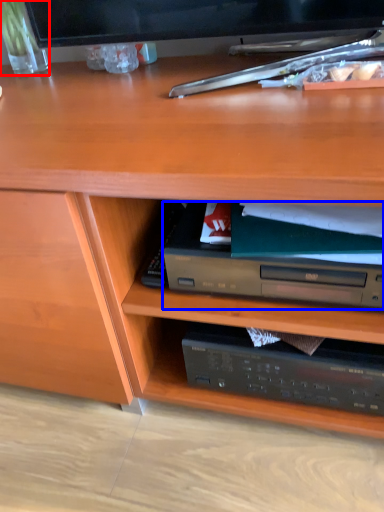
Question: Among these objects, which one is nearest to the camera, glass vase (highlighted by a red box) or paperback book (highlighted by a blue box)?

Choices:
 (A) glass vase
 (B) paperback book

Answer: (B)